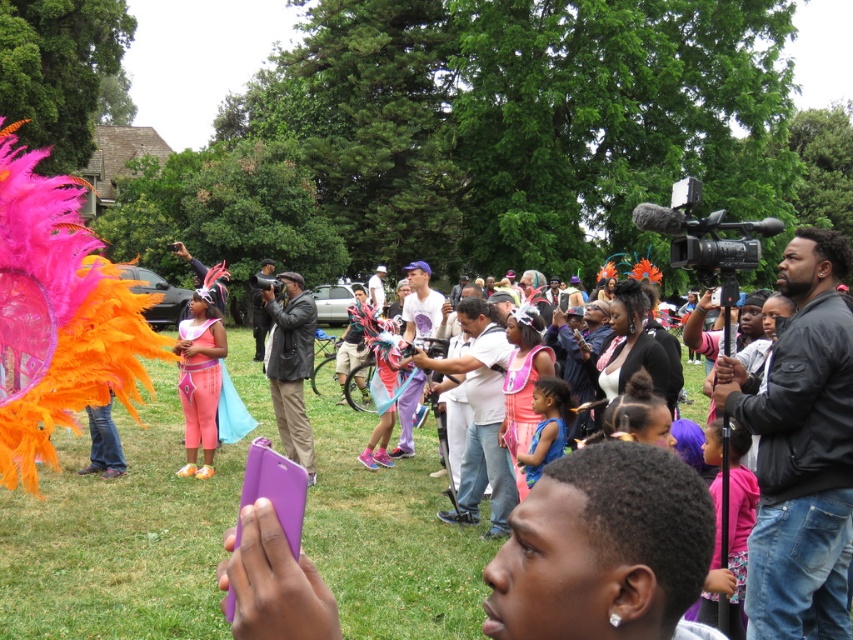
You are a photographer standing at the edge of the crowd. You want to capture a photo that includes both the leather jacket at center and the pink fabric dress at center. What is the minimum distance you need to move backward to ensure both subjects are in frame?

The minimum distance you need to move backward is 14.71 feet to ensure both the leather jacket at center and the pink fabric dress at center are in frame.

Looking at this image, you are organizing a photo shoot and need to arrange two models wearing the leather jacket at center and the pink fabric dress at center side by side. Which model should stand on the left to ensure both fit within a 2.5 meter wide frame?

The leather jacket at center is wider than the pink fabric dress at center. To fit both within the 2.5 meter frame, place the narrower pink fabric dress at center on the left and the wider leather jacket at center on the right, ensuring their combined widths do not exceed the frame width.

Based on the photo, you are a photographer at the event and need to capture a photo that includes both the leather jacket at center and the pink fabric dress at center. Which of the two should you focus on first to ensure they are both in frame?

The leather jacket at center is much taller than the pink fabric dress at center, so you should focus on the leather jacket at center first to ensure both are in frame.